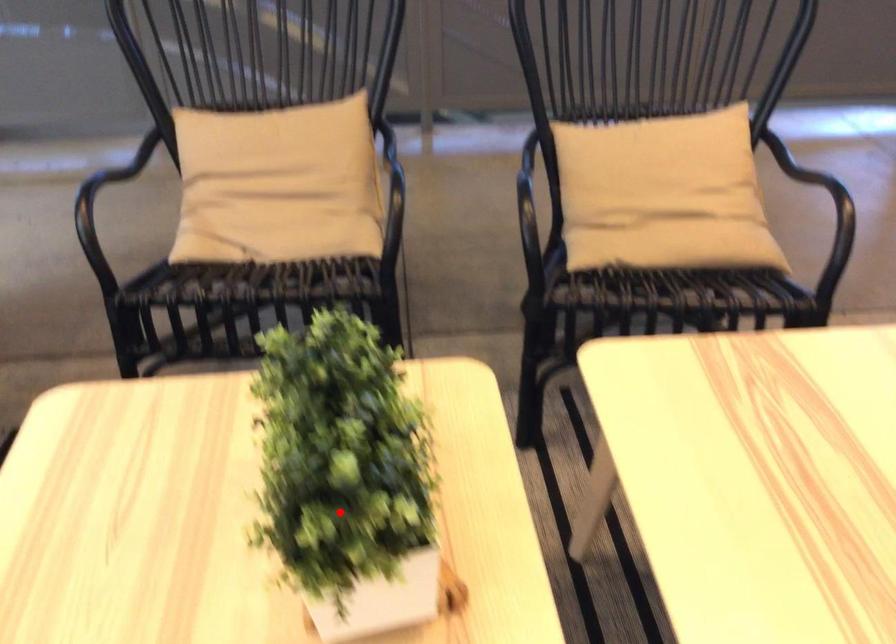
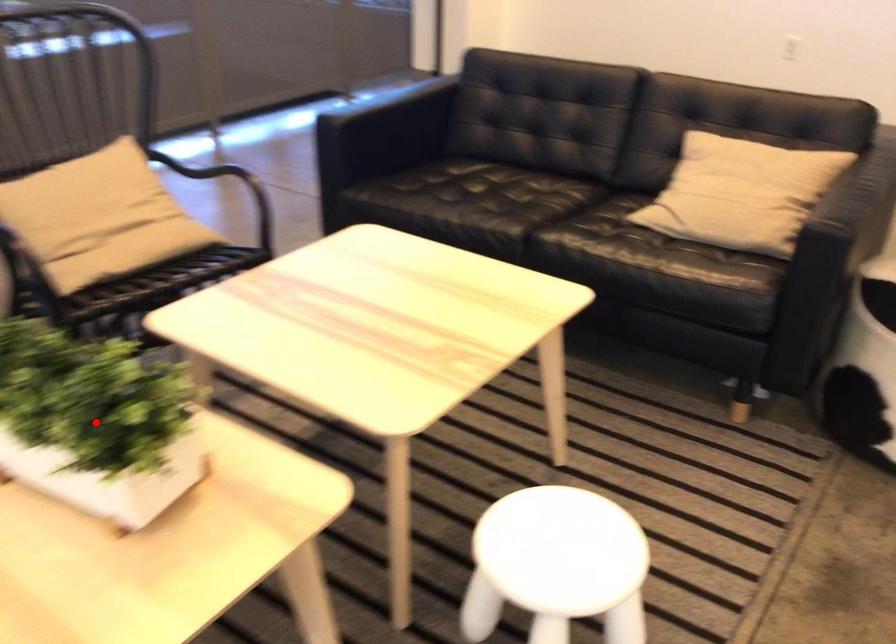
I am providing you with two images of the same scene from different viewpoints. A red point is marked on the first image and another point is marked on the second image. Does the point marked in image1 correspond to the same location as the one in image2?

Yes